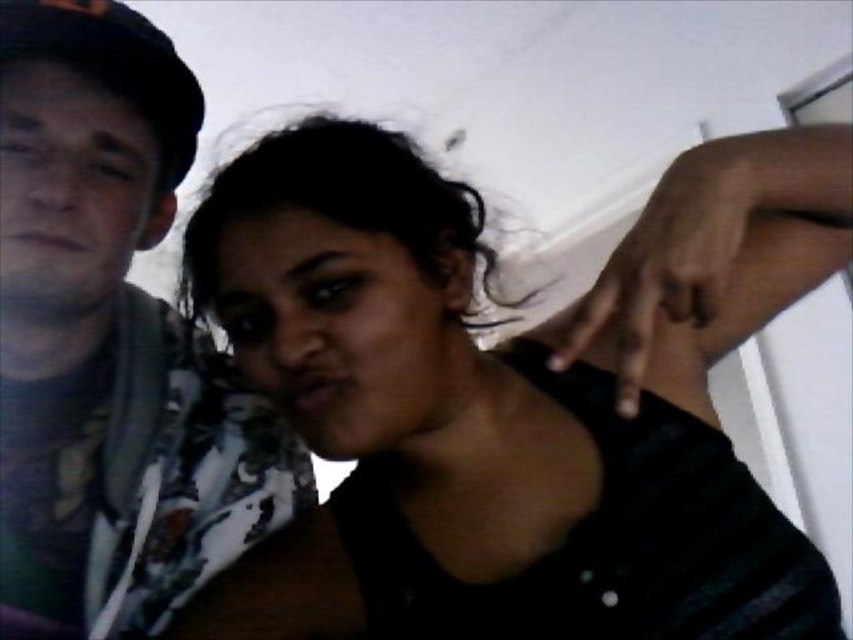
Does black matte shirt at center come behind matte black shirt at left?

That is False.

Can you confirm if black matte shirt at center is positioned below matte black shirt at left?

Yes, black matte shirt at center is below matte black shirt at left.

Does point (323, 540) lie behind point (21, 35)?

Yes.

Locate an element on the screen. The height and width of the screenshot is (640, 853). black matte shirt at center is located at coordinates (512, 400).